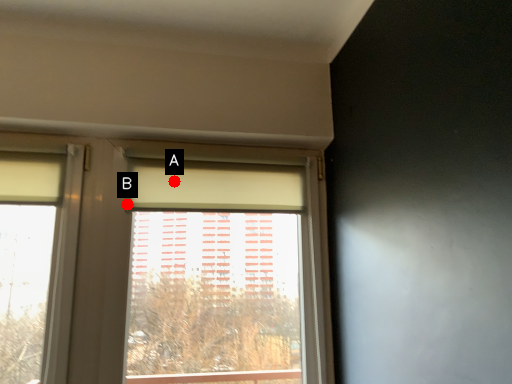
Question: Two points are circled on the image, labeled by A and B beside each circle. Among these points, which one is nearest to the camera?

Choices:
 (A) A is closer
 (B) B is closer

Answer: (B)